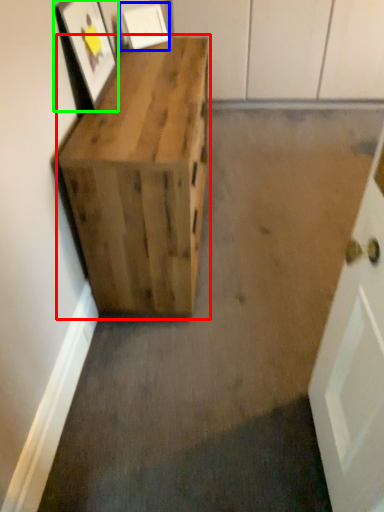
Question: Which is nearer to the furniture (highlighted by a red box)? picture frame (highlighted by a blue box) or picture frame (highlighted by a green box).

Choices:
 (A) picture frame
 (B) picture frame

Answer: (B)